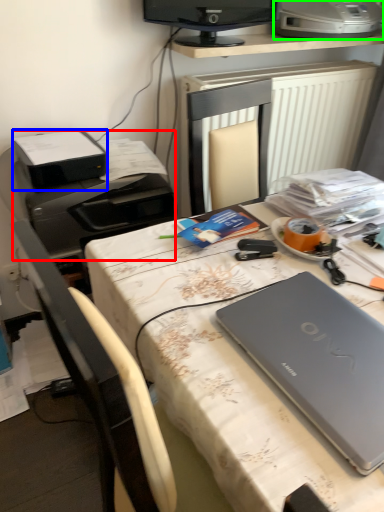
Question: Based on their relative distances, which object is farther from printer (highlighted by a red box)? Choose from printer (highlighted by a blue box) and printer (highlighted by a green box).

Choices:
 (A) printer
 (B) printer

Answer: (B)